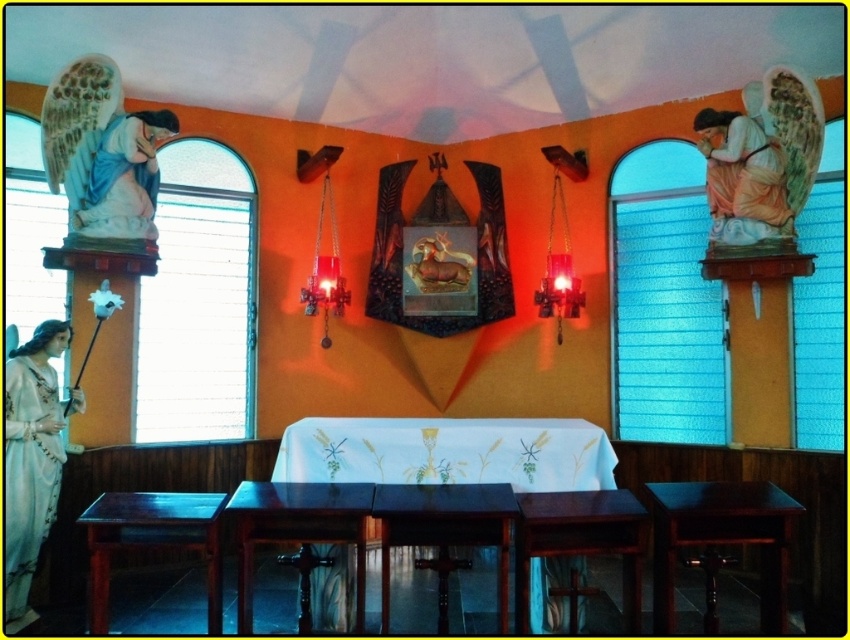
Does dark wood table at lower right have a greater height compared to glossy dark wood table at center?

No.

Does dark wood table at lower right appear over glossy dark wood table at center?

Yes, dark wood table at lower right is above glossy dark wood table at center.

Between point (735, 532) and point (329, 499), which one is positioned in front?

Point (735, 532) is in front.

Locate an element on the screen. This screenshot has width=850, height=640. dark wood table at lower right is located at coordinates (721, 540).

Is point (301, 493) positioned in front of point (204, 493)?

Yes, it is.

Is point (323, 516) more distant than point (99, 563)?

Yes, point (323, 516) is behind point (99, 563).

You are a GUI agent. You are given a task and a screenshot of the screen. Output one action in this format:
    pyautogui.click(x=<x>, y=<y>)
    Task: Click on the glossy dark wood table at center
    The width and height of the screenshot is (850, 640).
    Given the screenshot: What is the action you would take?
    pyautogui.click(x=298, y=529)

Which is behind, point (34, 385) or point (171, 515)?

The point (34, 385) is more distant.

Is white satin robe at left wider than mahogany wood table at lower left?

In fact, white satin robe at left might be narrower than mahogany wood table at lower left.

Locate an element on the screen. This screenshot has height=640, width=850. white satin robe at left is located at coordinates (29, 474).